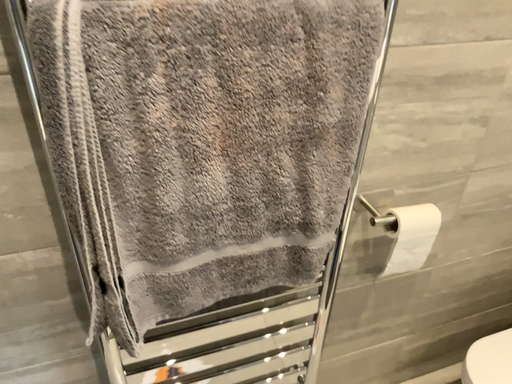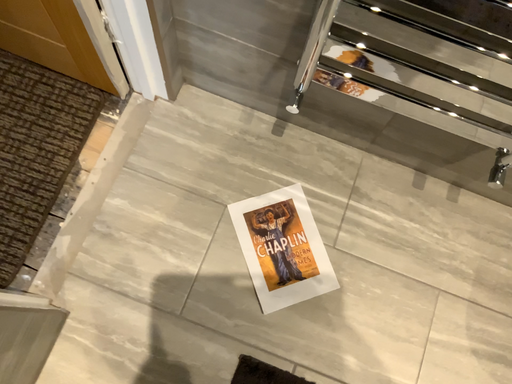
Question: How did the camera likely rotate when shooting the video?

Choices:
 (A) rotated left
 (B) rotated right

Answer: (A)